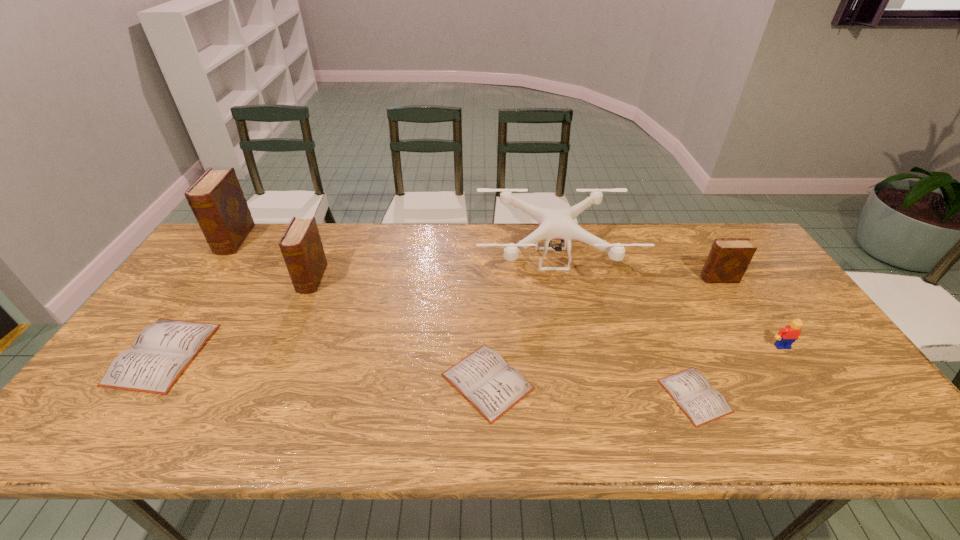
Find the location of a particular element. Image resolution: width=960 pixels, height=540 pixels. vacant space that's between the third shortest diary and the smallest brown diary is located at coordinates (441, 316).

At what (x,y) coordinates should I click in order to perform the action: click on vacant area that lies between the third shortest object and the fifth tallest object. Please return your answer as a coordinate pair (x, y). This screenshot has width=960, height=540. Looking at the image, I should click on coord(472,350).

Where is `vacant space that is in between the shortest object and the second tallest diary`? The width and height of the screenshot is (960, 540). vacant space that is in between the shortest object and the second tallest diary is located at coordinates pos(503,338).

Select which object appears as the third closest to the second white diary from right to left. Please provide its 2D coordinates. Your answer should be formatted as a tuple, i.e. [(x, y)], where the tuple contains the x and y coordinates of a point satisfying the conditions above.

[(301, 246)]

Identify the location of object that is the second closest to the shortest diary. (554, 224).

Where is `diary object that ranks as the third closest to the leftmost white diary`? diary object that ranks as the third closest to the leftmost white diary is located at coordinates (483, 378).

This screenshot has height=540, width=960. What are the coordinates of `diary that can be found as the second closest to the drone` in the screenshot? It's located at (728, 259).

Locate an element on the screen. brown diary that stands as the closest to the sixth object from right to left is located at coordinates click(x=217, y=201).

The height and width of the screenshot is (540, 960). I want to click on brown diary that can be found as the third closest to the Lego, so 217,201.

Identify which white diary is the closest to the third shortest diary. Please provide its 2D coordinates. Your answer should be formatted as a tuple, i.e. [(x, y)], where the tuple contains the x and y coordinates of a point satisfying the conditions above.

[(483, 378)]